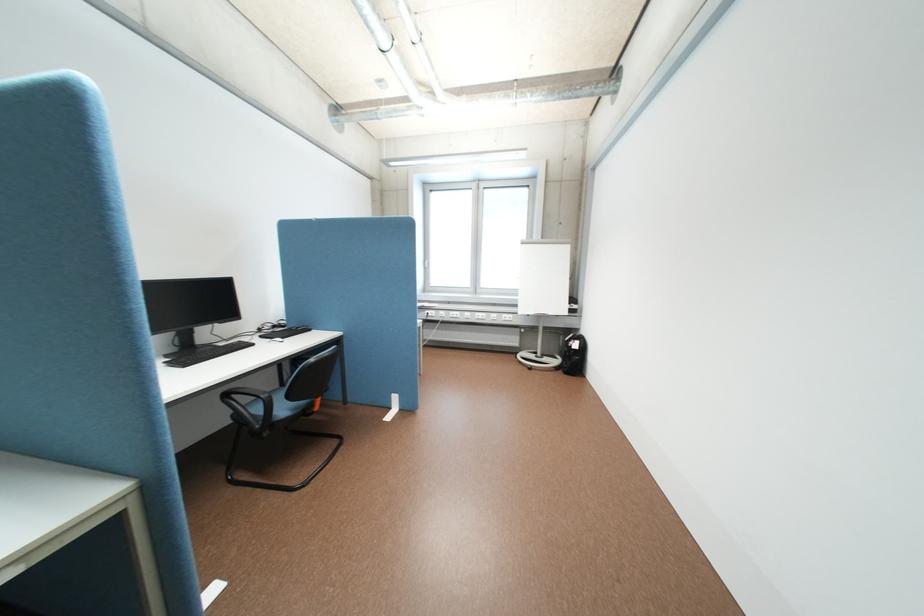
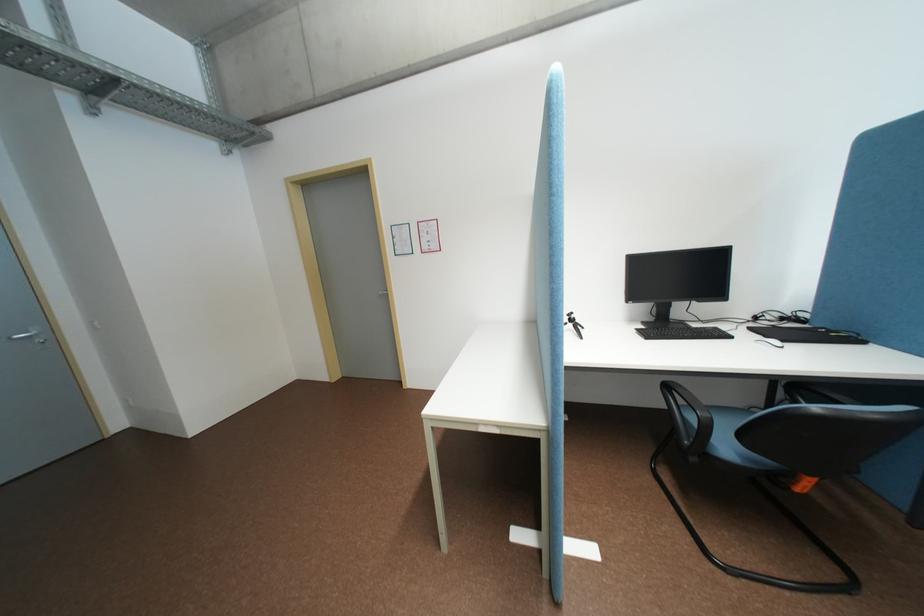
Locate, in the second image, the point that corresponds to point 299,397 in the first image.

(755, 437)